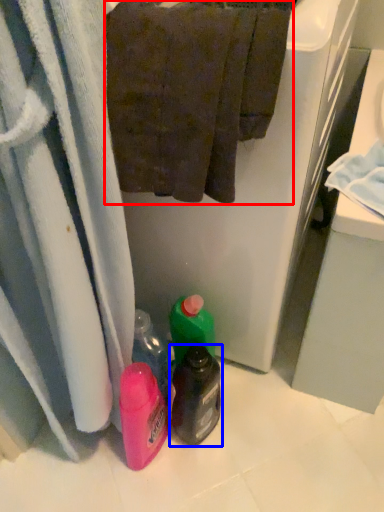
Question: Which object appears farthest to the camera in this image, towel (highlighted by a red box) or bottle (highlighted by a blue box)?

Choices:
 (A) towel
 (B) bottle

Answer: (B)